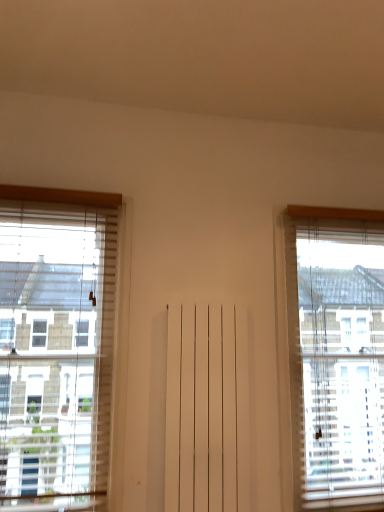
Question: From the image's perspective, is white wooden window at left, acting as the 1th window starting from the left, above or below translucent wood window at right, the 1th window from the right?

Choices:
 (A) above
 (B) below

Answer: (A)

Question: Considering the positions of point (4, 218) and point (367, 247), is point (4, 218) closer or farther from the camera than point (367, 247)?

Choices:
 (A) closer
 (B) farther

Answer: (A)

Question: From a real-world perspective, relative to translucent wood window at right, the 1th window from the right, is white wooden window at left, positioned as the 2th window in right-to-left order, vertically above or below?

Choices:
 (A) above
 (B) below

Answer: (A)

Question: Is translucent wood window at right, the 1th window from the right, in front of or behind white wooden window at left, acting as the 1th window starting from the left, in the image?

Choices:
 (A) behind
 (B) front

Answer: (A)

Question: From their relative heights in the image, would you say translucent wood window at right, which ranks as the 2th window in left-to-right order, is taller or shorter than white wooden window at left, acting as the 1th window starting from the left?

Choices:
 (A) short
 (B) tall

Answer: (B)

Question: Is point (339, 472) positioned closer to the camera than point (33, 250)?

Choices:
 (A) closer
 (B) farther

Answer: (B)

Question: From the image's perspective, relative to white wooden window at left, acting as the 1th window starting from the left, is translucent wood window at right, the 1th window from the right, above or below?

Choices:
 (A) below
 (B) above

Answer: (A)